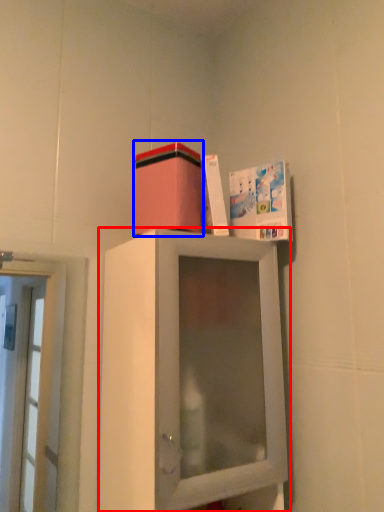
Question: Which object appears closest to the camera in this image, cabinetry (highlighted by a red box) or cardboard box (highlighted by a blue box)?

Choices:
 (A) cabinetry
 (B) cardboard box

Answer: (A)